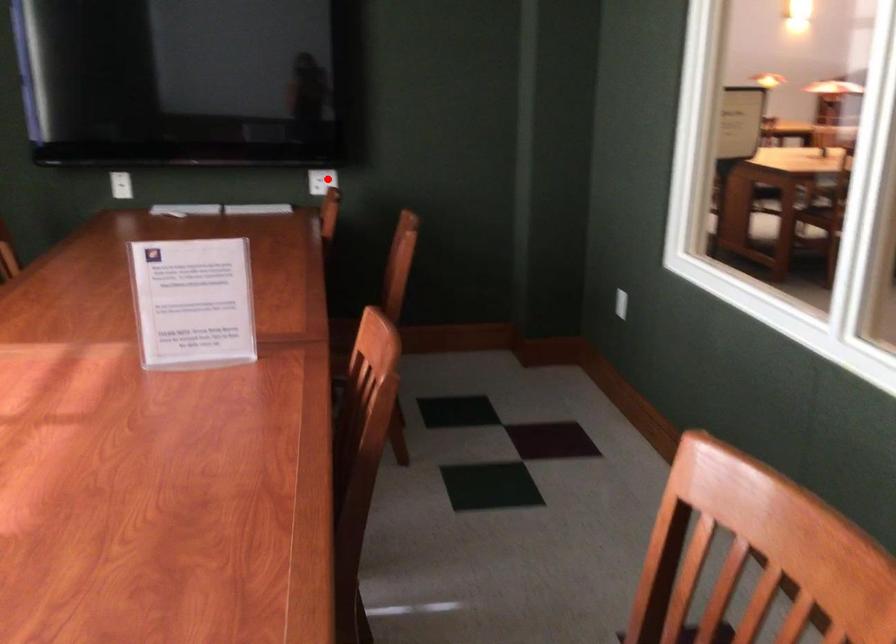
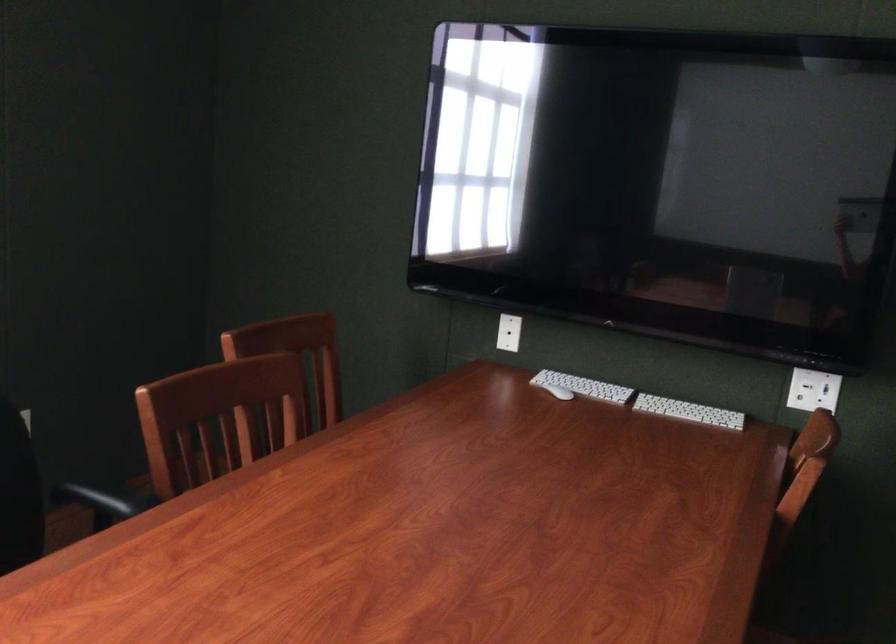
Locate, in the second image, the point that corresponds to the highlighted location in the first image.

(813, 390)